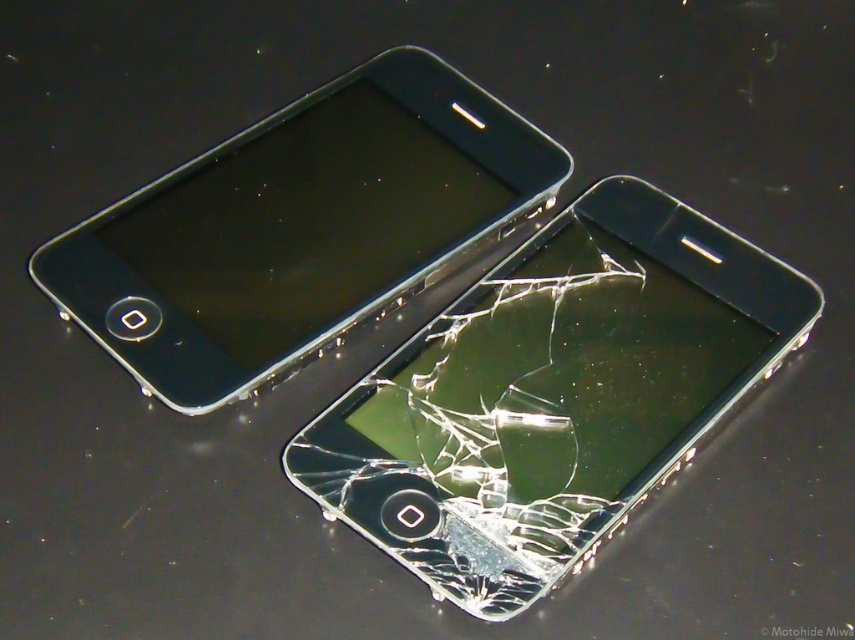
Question: Which of the following is the closest to the observer?

Choices:
 (A) (192, 314)
 (B) (691, 232)

Answer: (A)

Question: Which object appears farthest from the camera in this image?

Choices:
 (A) transparent glass smartphone at center
 (B) matte black smartphone at upper left

Answer: (B)

Question: Considering the relative positions of transparent glass smartphone at center and matte black smartphone at upper left in the image provided, where is transparent glass smartphone at center located with respect to matte black smartphone at upper left?

Choices:
 (A) right
 (B) left

Answer: (A)

Question: Does transparent glass smartphone at center have a lesser width compared to matte black smartphone at upper left?

Choices:
 (A) yes
 (B) no

Answer: (A)

Question: Does transparent glass smartphone at center appear over matte black smartphone at upper left?

Choices:
 (A) no
 (B) yes

Answer: (A)